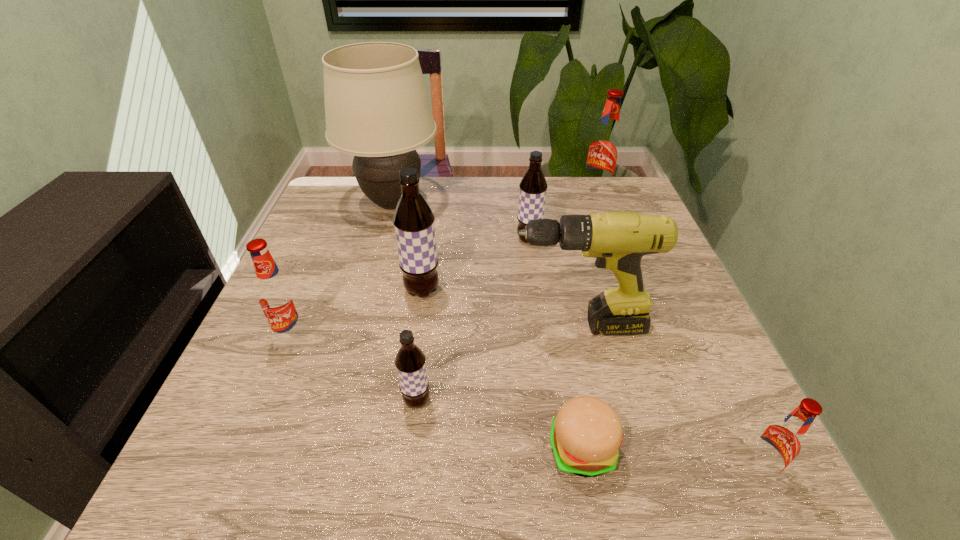
This screenshot has height=540, width=960. Find the location of `the smallest brown root beer`. the smallest brown root beer is located at coordinates (410, 361).

You are a GUI agent. You are given a task and a screenshot of the screen. Output one action in this format:
    pyautogui.click(x=<x>, y=<y>)
    Task: Click on the nearest brown root beer
    
    Given the screenshot: What is the action you would take?
    pyautogui.click(x=410, y=361)

The height and width of the screenshot is (540, 960). I want to click on the rightmost root beer, so click(x=780, y=442).

Identify the location of the smallest red root beer. The width and height of the screenshot is (960, 540). (780, 442).

In order to click on the shortest object in this screenshot , I will do `click(586, 434)`.

Find the location of a particular element. The image size is (960, 540). beige hamburger is located at coordinates (586, 434).

Identify the location of vacant area located on the left of the tallest object. The width and height of the screenshot is (960, 540). (326, 203).

Locate an element on the screen. This screenshot has width=960, height=540. free spot located on the left of the farthest root beer is located at coordinates pyautogui.click(x=564, y=193).

Where is `free space located on the front of the biggest brown root beer`? Image resolution: width=960 pixels, height=540 pixels. free space located on the front of the biggest brown root beer is located at coordinates (396, 478).

The width and height of the screenshot is (960, 540). I want to click on vacant area located 0.390m on the handle side of the drill, so click(x=324, y=326).